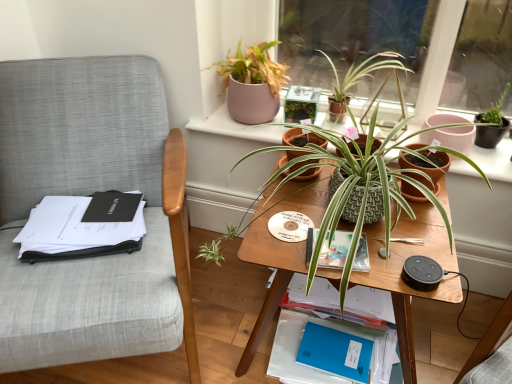
You are a GUI agent. You are given a task and a screenshot of the screen. Output one action in this format:
    pyautogui.click(x=<x>, y=<y>)
    Task: Click on the free space above blue matte notebook at lower center (from a real-world perspective)
    
    Given the screenshot: What is the action you would take?
    pyautogui.click(x=344, y=347)